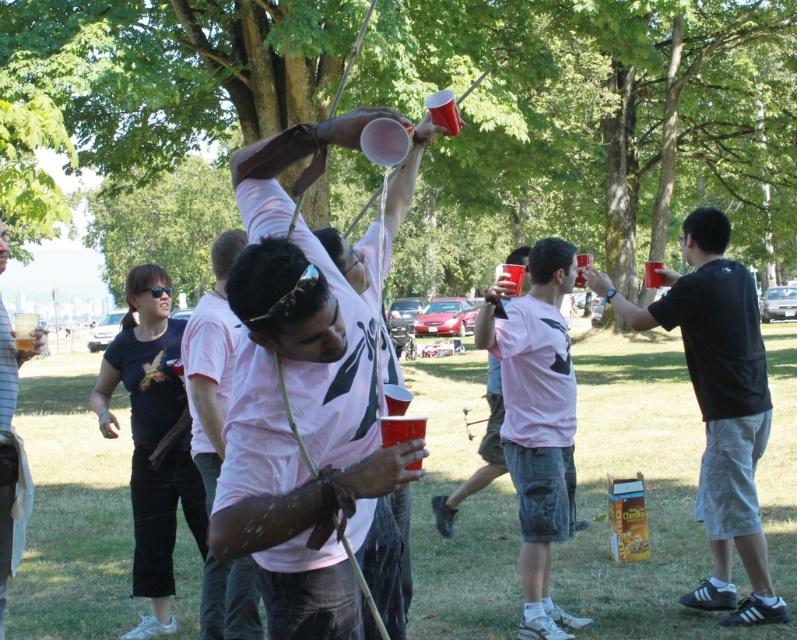
Question: Which of the following is the closest to the observer?

Choices:
 (A) black matte shirt at right
 (B) matte black t-shirt at center

Answer: (B)

Question: Which of the following is the closest to the observer?

Choices:
 (A) (199, 392)
 (B) (668, 321)
 (C) (512, 388)

Answer: (A)

Question: Does black matte shirt at right lie in front of pink matte t-shirt at center?

Choices:
 (A) yes
 (B) no

Answer: (B)

Question: Does matte pink shirt at center appear over matte black t-shirt at center?

Choices:
 (A) no
 (B) yes

Answer: (B)

Question: Can you confirm if matte pink shirt at center is bigger than matte pink t-shirt at center?

Choices:
 (A) yes
 (B) no

Answer: (B)

Question: Which object appears closest to the camera in this image?

Choices:
 (A) black matte shirt at right
 (B) matte pink shirt at center

Answer: (B)